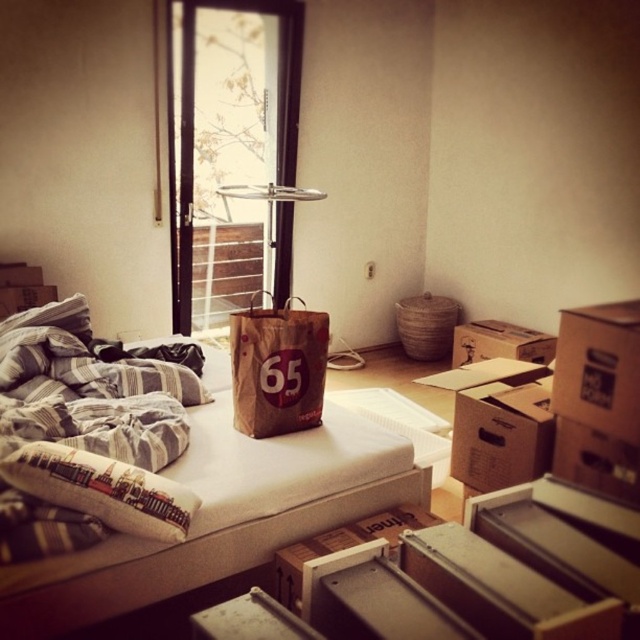
In the scene shown: You are standing in the room and need to place a new rug. Where exactly is the white foam mattress at center located in the room?

The white foam mattress at center is located at point (221,516) in the room.

You are helping to organize a room and need to place the brown cardboard box at lower center on top of the white foam mattress at center. Is this possible given their sizes?

The white foam mattress at center is larger in size than the brown cardboard box at lower center, so yes, the brown cardboard box at lower center can be placed on top of the white foam mattress at center since it is smaller and will fit.

You are a delivery person who needs to place a new box between the brown cardboard box at lower right and the brown cardboard box at lower center. Can you fit the new box there?

The distance between the brown cardboard box at lower right and the brown cardboard box at lower center is 21.41 inches. If the new box is smaller than this distance, it can be placed there.